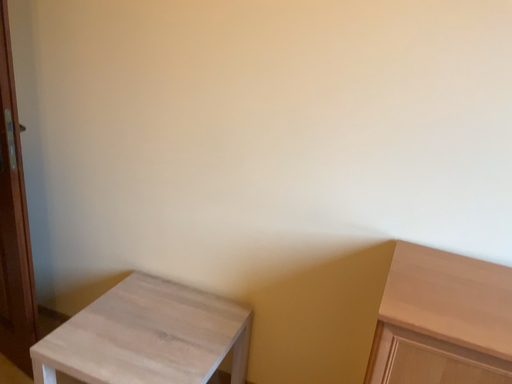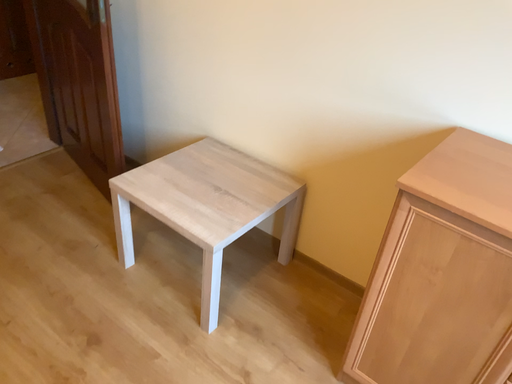
Question: How did the camera likely rotate when shooting the video?

Choices:
 (A) rotated upward
 (B) rotated downward

Answer: (B)